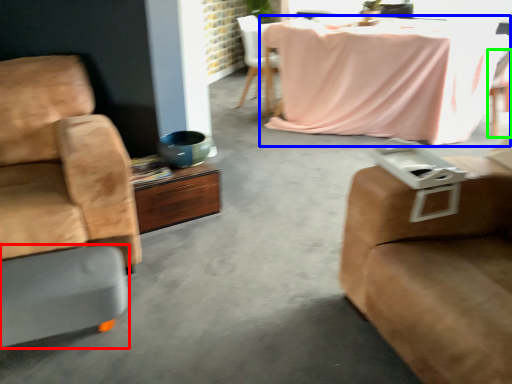
Question: Which is nearer to the footrest (highlighted by a red box)? kitchen & dining room table (highlighted by a blue box) or chair (highlighted by a green box).

Choices:
 (A) kitchen & dining room table
 (B) chair

Answer: (A)